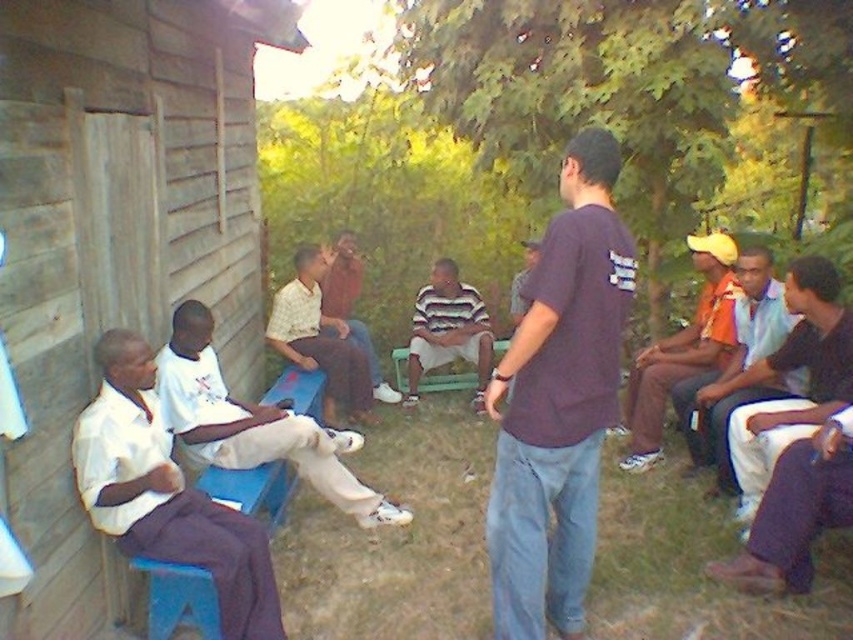
You are standing in front of the wooden structure and want to take a photo that includes both point (808, 428) and point (279, 326). Based on their positions, which point should you focus on first to ensure both are in clear view?

You should focus on point (808, 428) first because it is closer to the camera than point (279, 326), ensuring both points are in focus when using a camera with a fixed focal plane.

You are a tailor who needs to determine which shirt is more suitable for a client who prefers lightweight clothing. Based on the image, which of the two shirts, the white cotton shirt at right or the light brown fabric shirt at center, is thinner and therefore lighter?

The white cotton shirt at right is thinner than the light brown fabric shirt at center, making it the lighter option for the client.